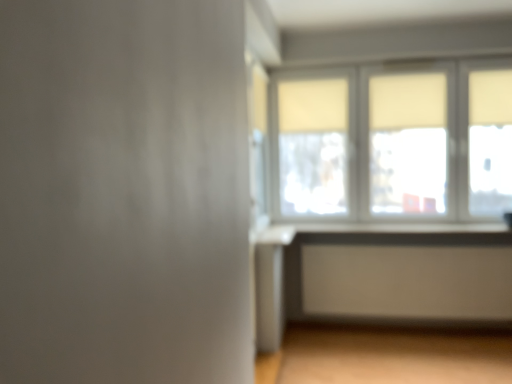
The width and height of the screenshot is (512, 384). I want to click on blank space situated above matte glass window at upper right (from a real-world perspective), so click(388, 64).